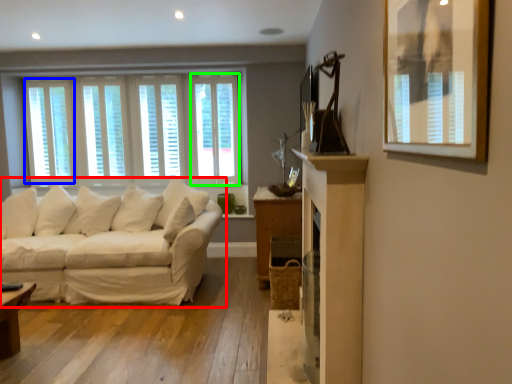
Question: Estimate the real-world distances between objects in this image. Which object is farther from studio couch (highlighted by a red box), window (highlighted by a blue box) or window (highlighted by a green box)?

Choices:
 (A) window
 (B) window

Answer: (A)